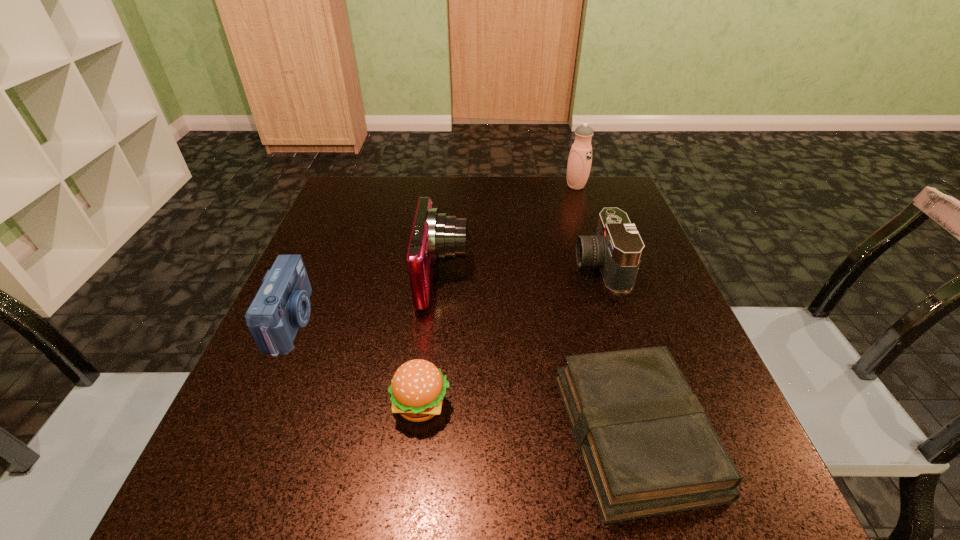
You are a GUI agent. You are given a task and a screenshot of the screen. Output one action in this format:
    pyautogui.click(x=<x>, y=<y>)
    Task: Click on the camera that is at the right edge
    
    Given the screenshot: What is the action you would take?
    pyautogui.click(x=617, y=248)

This screenshot has width=960, height=540. I want to click on book located in the right edge section of the desktop, so click(648, 448).

Locate an element on the screen. object at the far right corner is located at coordinates (580, 157).

Find the location of a particular element. object that is at the near right corner is located at coordinates (648, 448).

At what (x,y) coordinates should I click in order to perform the action: click on vacant space at the far edge of the desktop. Please return your answer as a coordinate pair (x, y). Looking at the image, I should click on (401, 201).

Locate an element on the screen. free space at the left edge of the desktop is located at coordinates (323, 236).

I want to click on free location at the right edge of the desktop, so click(636, 311).

What are the coordinates of `vacant region at the far right corner of the desktop` in the screenshot? It's located at (597, 197).

Where is `free space between the thermos bottle and the hamburger`? This screenshot has width=960, height=540. free space between the thermos bottle and the hamburger is located at coordinates (498, 295).

At what (x,y) coordinates should I click in order to perform the action: click on free spot between the tallest camera and the shortest object. Please return your answer as a coordinate pair (x, y). This screenshot has height=540, width=960. Looking at the image, I should click on (539, 355).